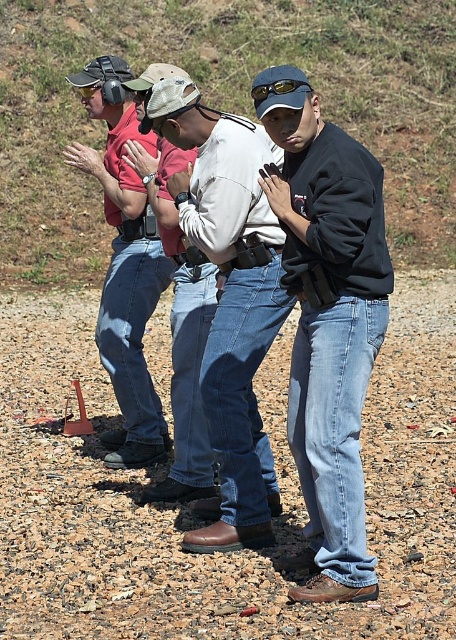
Between matte black shirt at left and sunglassestransparent at center, which one is positioned lower?

matte black shirt at left is lower down.

Who is more distant from viewer, (128, 328) or (262, 99)?

Point (128, 328)

Where is `matte black shirt at left`? The width and height of the screenshot is (456, 640). matte black shirt at left is located at coordinates (124, 266).

Does brown leather boots at center appear under matte black shirt at left?

Indeed, brown leather boots at center is positioned under matte black shirt at left.

Does point (224, 364) come behind point (109, 180)?

No.

Identify the location of brown leather boots at center. This screenshot has width=456, height=640. click(229, 298).

Between brown leather boots at center and sunglassestransparent at center, which one appears on the left side from the viewer's perspective?

brown leather boots at center

Can you confirm if brown leather boots at center is wider than sunglassestransparent at center?

Yes, brown leather boots at center is wider than sunglassestransparent at center.

Locate an element on the screen. This screenshot has width=456, height=640. brown leather boots at center is located at coordinates (229, 298).

Locate an element on the screen. brown leather boots at center is located at coordinates (229, 298).